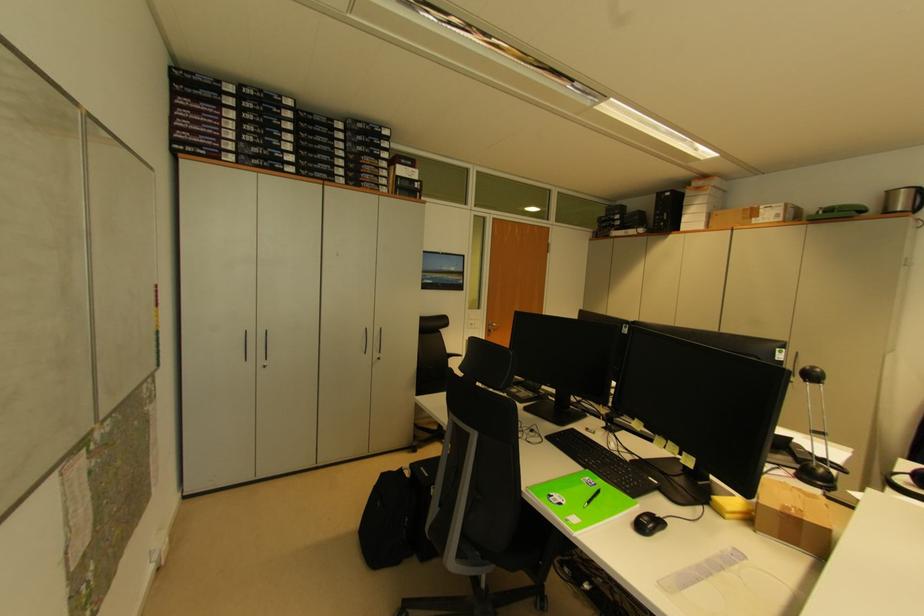
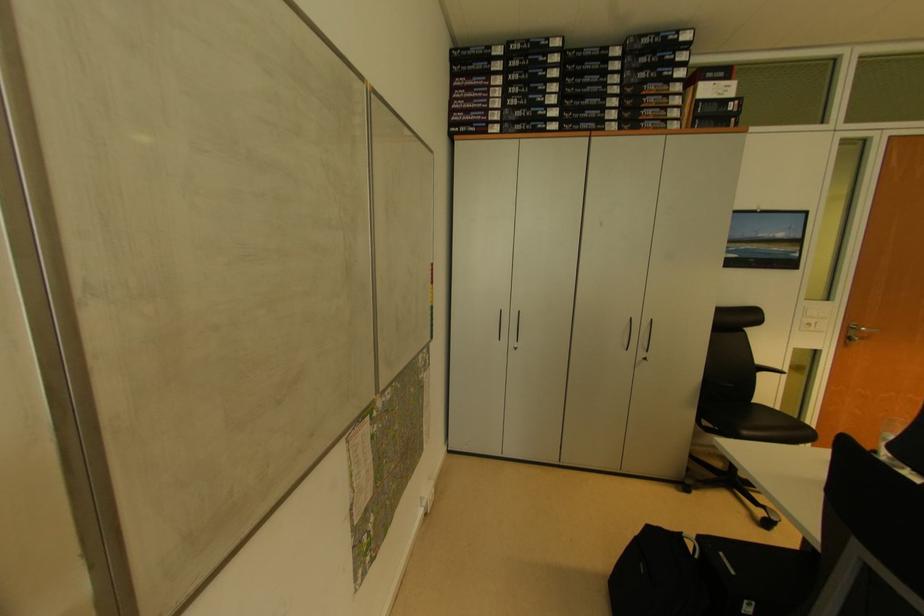
Locate, in the second image, the point that corresponds to pixel 263 365 in the first image.

(515, 346)